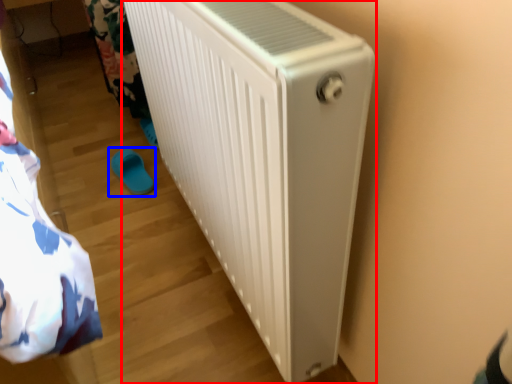
Question: Which point is closer to the camera, home appliance (highlighted by a red box) or footwear (highlighted by a blue box)?

Choices:
 (A) home appliance
 (B) footwear

Answer: (A)